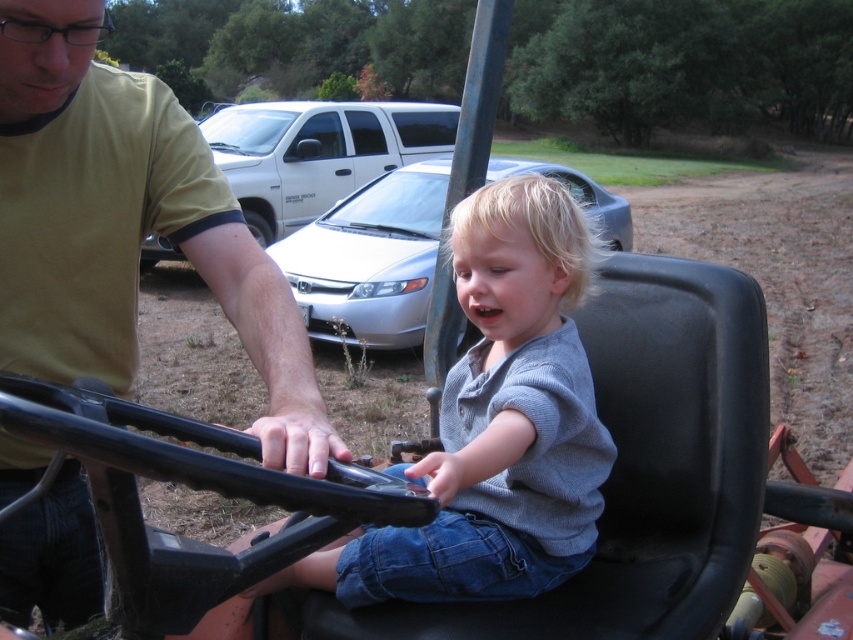
Question: Which object is the farthest from the satin silver sedan at center?

Choices:
 (A) gray cotton shirt at center
 (B) silver metallic sedan at center
 (C) yellow matte shirt at upper left

Answer: (A)

Question: Is the position of gray cotton shirt at center less distant than that of satin silver sedan at center?

Choices:
 (A) no
 (B) yes

Answer: (B)

Question: Where is gray cotton shirt at center located in relation to satin silver sedan at center in the image?

Choices:
 (A) above
 (B) below

Answer: (B)

Question: Does satin silver sedan at center lie in front of silver metallic sedan at center?

Choices:
 (A) yes
 (B) no

Answer: (B)

Question: Which object is farther from the camera taking this photo?

Choices:
 (A) yellow matte shirt at upper left
 (B) satin silver sedan at center
 (C) gray cotton shirt at center

Answer: (B)

Question: Which point is closer to the camera taking this photo?

Choices:
 (A) (532, 436)
 (B) (57, 609)
 (C) (345, 259)

Answer: (A)